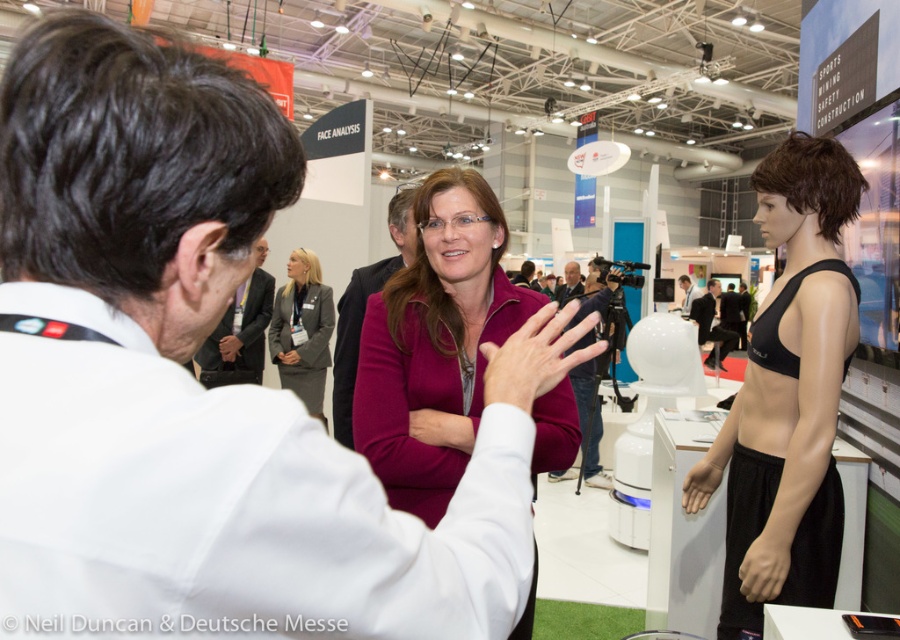
Question: Does white shirt at center appear on the right side of matte white ear at upper left?

Choices:
 (A) yes
 (B) no

Answer: (A)

Question: Which object appears farthest from the camera in this image?

Choices:
 (A) purple matte sweater at center
 (B) black matte mannequin at center

Answer: (B)

Question: Based on their relative distances, which object is farther from the purple matte sweater at center?

Choices:
 (A) gray fabric suit at center
 (B) matte black bra at center
 (C) matte black jacket at center
 (D) purple matte jacket at center

Answer: (C)

Question: Among these points, which one is farthest from the camera?

Choices:
 (A) (524, 262)
 (B) (302, 269)

Answer: (A)

Question: Is gray fabric suit at center positioned behind purple matte sweater at center?

Choices:
 (A) no
 (B) yes

Answer: (B)

Question: Is matte black bra at center to the right of black matte mannequin at center from the viewer's perspective?

Choices:
 (A) yes
 (B) no

Answer: (B)